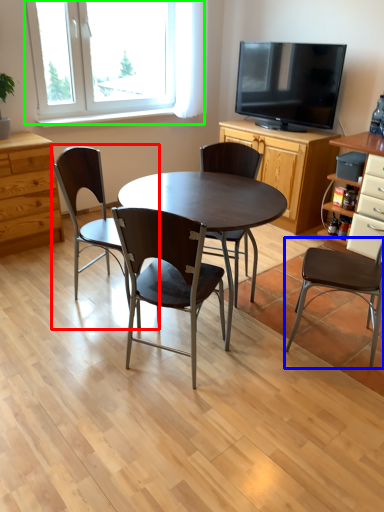
Question: Which object is the farthest from chair (highlighted by a red box)? Choose among these: chair (highlighted by a blue box) or window (highlighted by a green box).

Choices:
 (A) chair
 (B) window

Answer: (B)